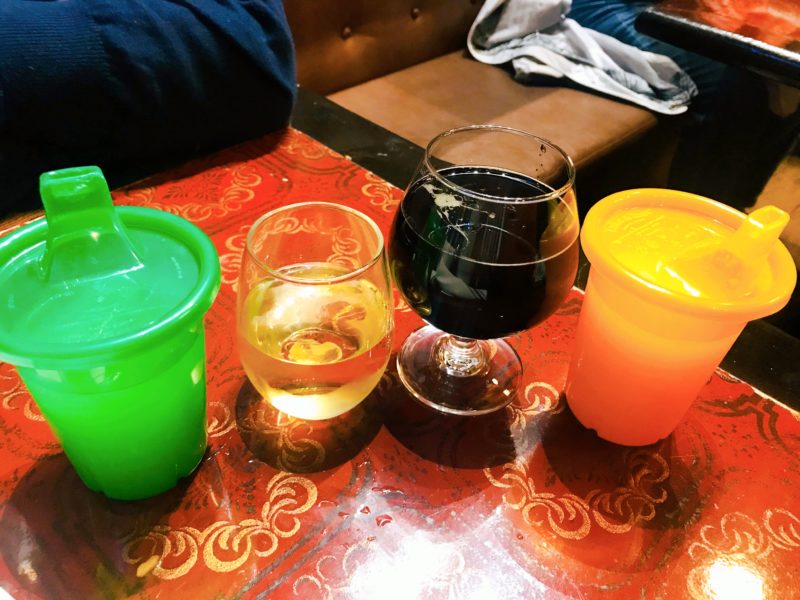
Locate an element on the screen. liquor is located at coordinates (470, 283).